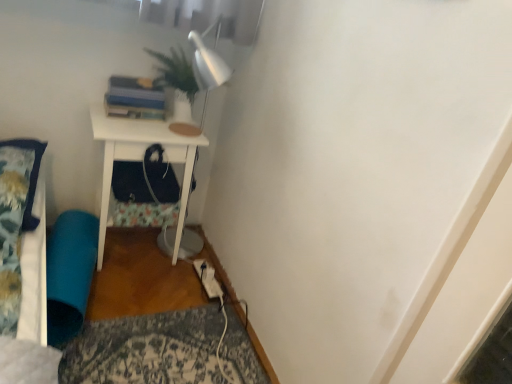
The image size is (512, 384). I want to click on vacant space in front of white matte nightstand at center, so click(x=125, y=292).